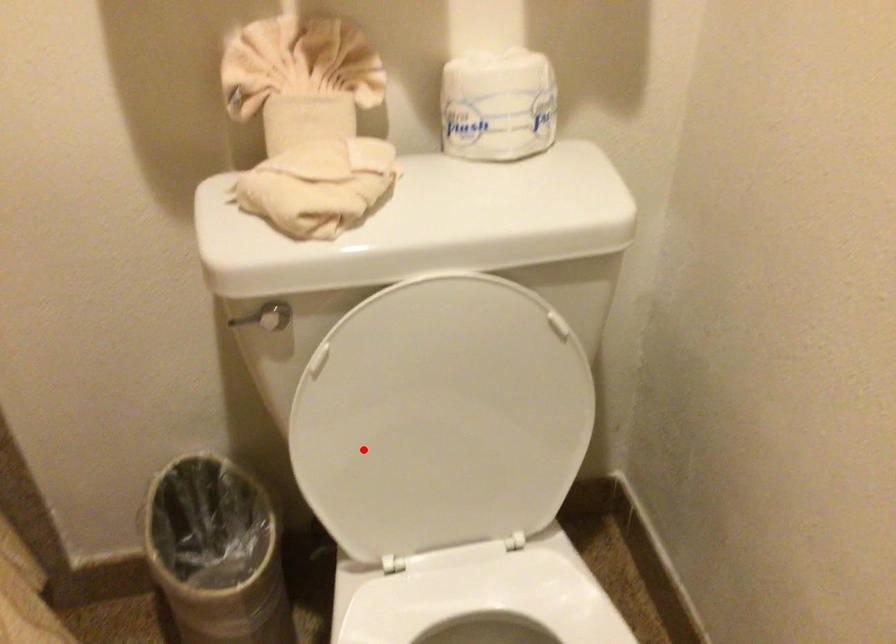
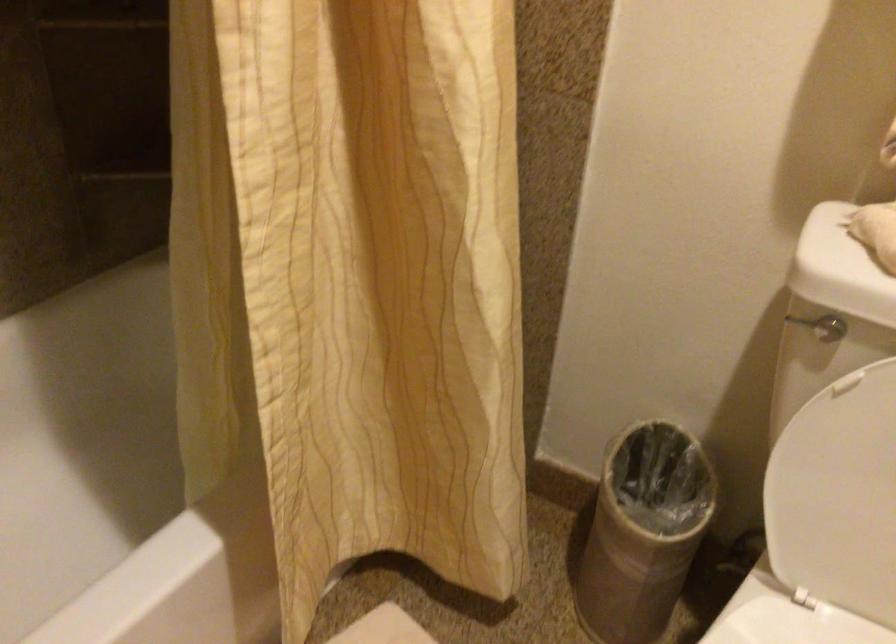
Question: I am providing you with two images of the same scene from different viewpoints. A red point is marked on the first image. Is the red point's position out of view in image 2?

Choices:
 (A) Yes
 (B) No

Answer: (B)